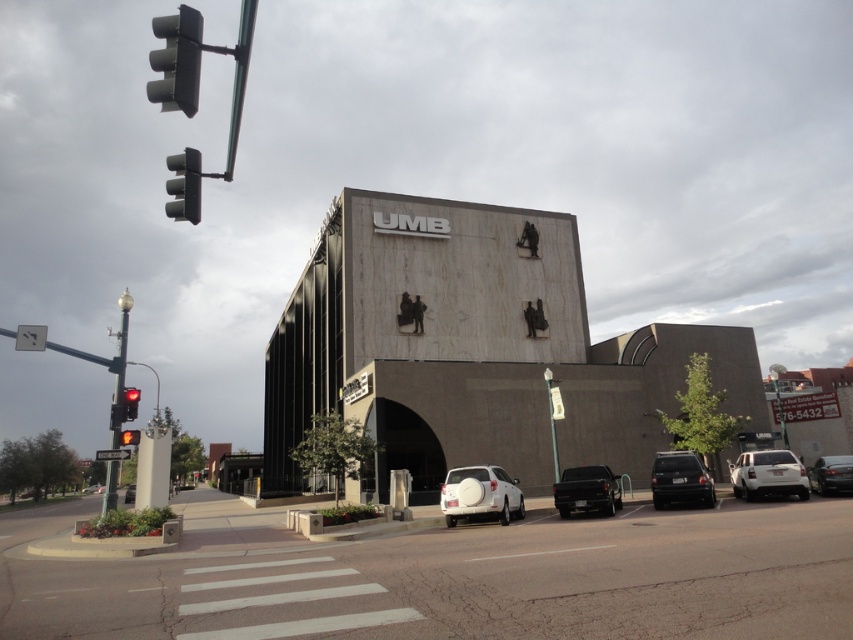
Does black matte suv at center-right have a larger size compared to shiny black truck at center?

Correct, black matte suv at center-right is larger in size than shiny black truck at center.

Which is behind, point (672, 484) or point (560, 508)?

The point (672, 484) is more distant.

The height and width of the screenshot is (640, 853). I want to click on black matte suv at center-right, so click(680, 480).

Who is higher up, black plastic traffic light at upper left or red glass traffic light at upper left?

black plastic traffic light at upper left is above.

Is point (161, 19) positioned after point (120, 435)?

That is False.

Where is `black plastic traffic light at upper left`? This screenshot has width=853, height=640. black plastic traffic light at upper left is located at coordinates click(177, 60).

Is black plastic traffic light at upper left positioned behind metallic traffic light at upper left?

No, it is in front of metallic traffic light at upper left.

Who is more forward, (160, 58) or (177, 192)?

Positioned in front is point (160, 58).

Describe the element at coordinates (177, 60) in the screenshot. I see `black plastic traffic light at upper left` at that location.

This screenshot has height=640, width=853. In order to click on black plastic traffic light at upper left in this screenshot , I will do `click(177, 60)`.